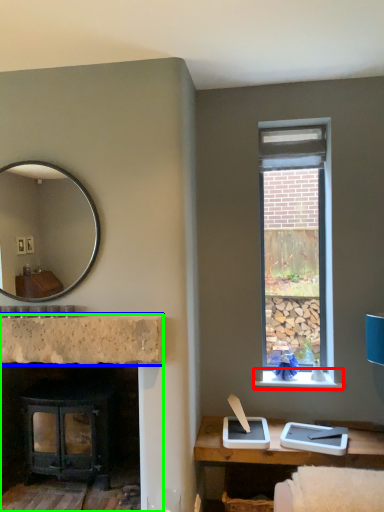
Question: Which is farther away from window sill (highlighted by a red box)? counter top (highlighted by a blue box) or fireplace (highlighted by a green box)?

Choices:
 (A) counter top
 (B) fireplace

Answer: (B)